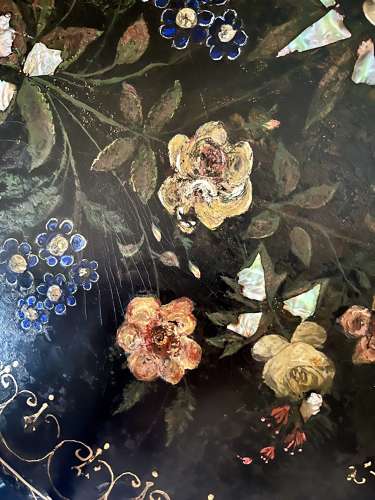
This screenshot has height=500, width=375. I want to click on painting, so click(273, 91).